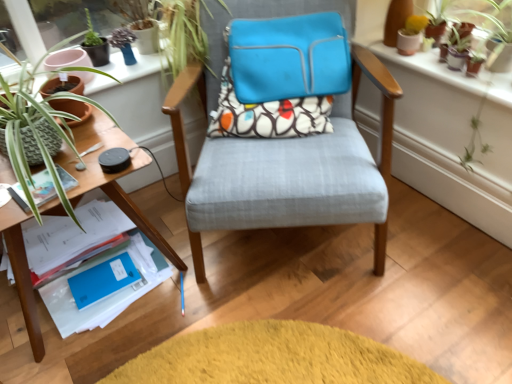
Find the location of `vacant area that is in front of textured fabric chair at center, marked as the second chair in a back-to-front arrangement`. vacant area that is in front of textured fabric chair at center, marked as the second chair in a back-to-front arrangement is located at coordinates (314, 330).